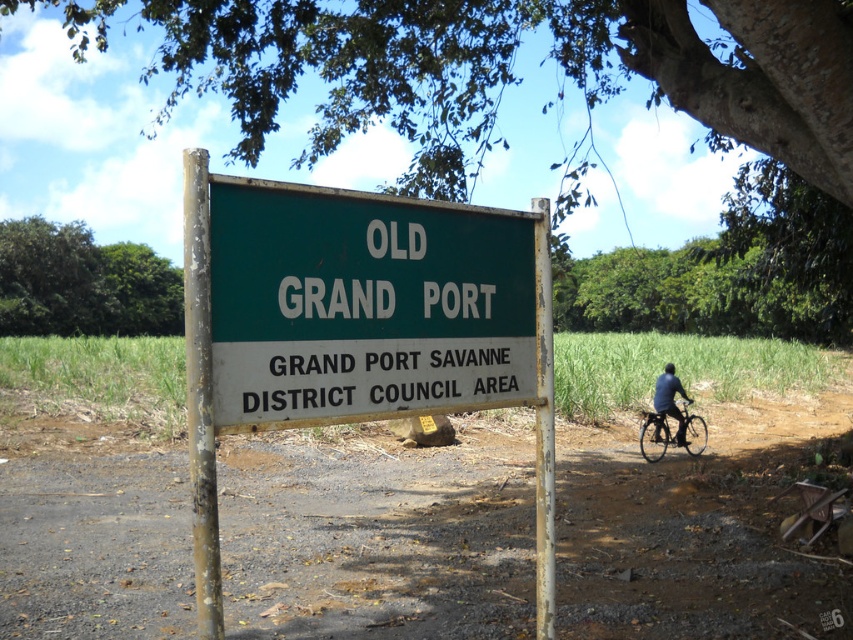
Question: Which of the following is the farthest from the observer?

Choices:
 (A) (444, 282)
 (B) (672, 444)
 (C) (663, 497)

Answer: (B)

Question: Estimate the real-world distances between objects in this image. Which object is closer to the green matte signboard at center?

Choices:
 (A) green painted metal sign at center
 (B) shiny black bicycle at right
 (C) brown dirt field at center

Answer: (A)

Question: Is green leafy tree at upper center to the right of green matte signboard at center from the viewer's perspective?

Choices:
 (A) yes
 (B) no

Answer: (A)

Question: Which point is closer to the camera?

Choices:
 (A) green matte signboard at center
 (B) green leafy tree at upper left
 (C) shiny black bicycle at right
 (D) brown dirt field at center

Answer: (A)

Question: Does green leafy tree at upper center appear under green matte signboard at center?

Choices:
 (A) yes
 (B) no

Answer: (B)

Question: Can you confirm if green leafy tree at upper left is bigger than shiny black bicycle at right?

Choices:
 (A) no
 (B) yes

Answer: (B)